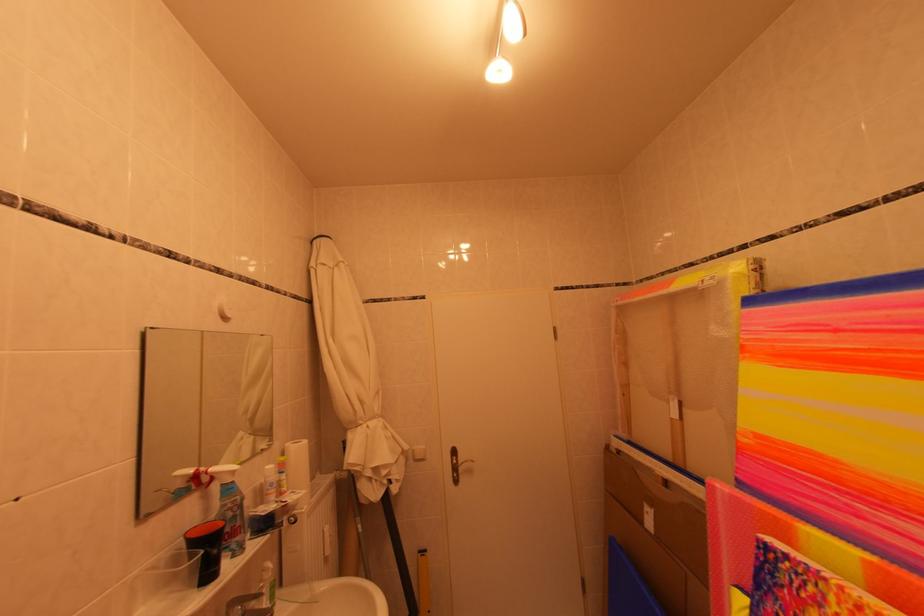
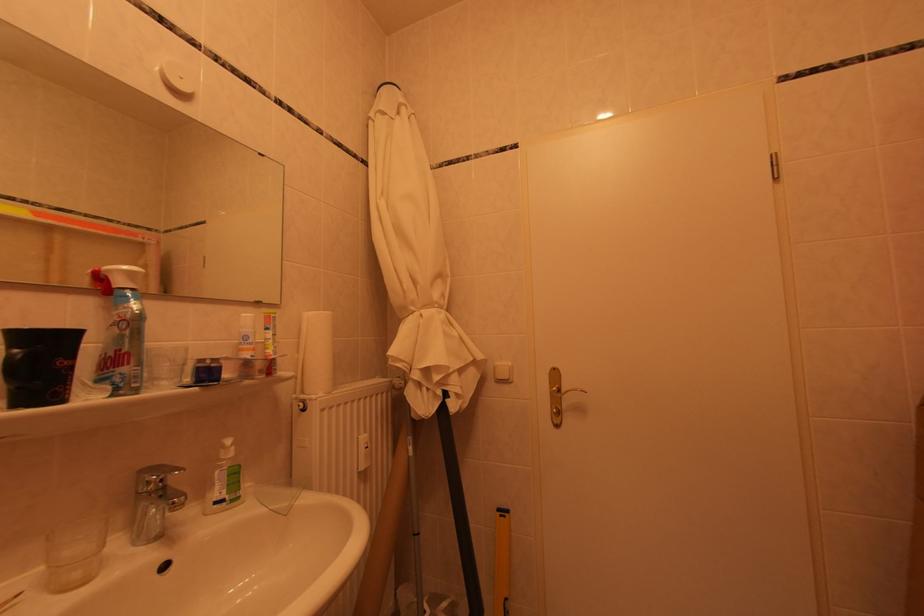
Where in the second image is the point corresponding to (238,557) from the first image?

(119, 391)